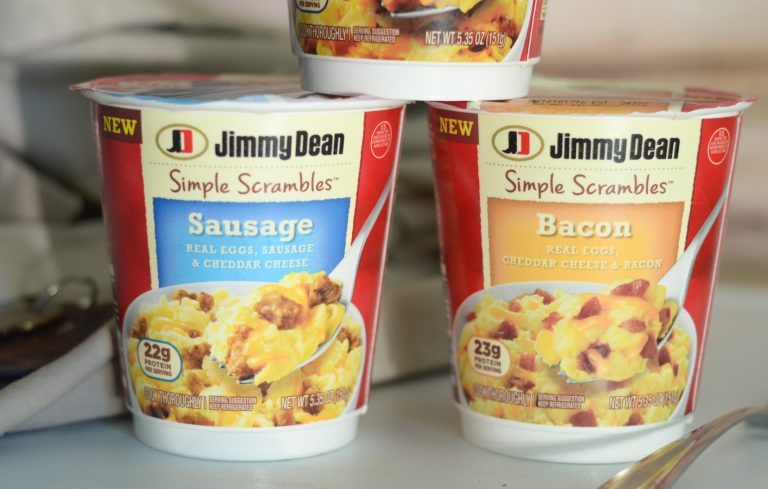
Locate an element on the screen. The image size is (768, 489). fork is located at coordinates (346, 282).